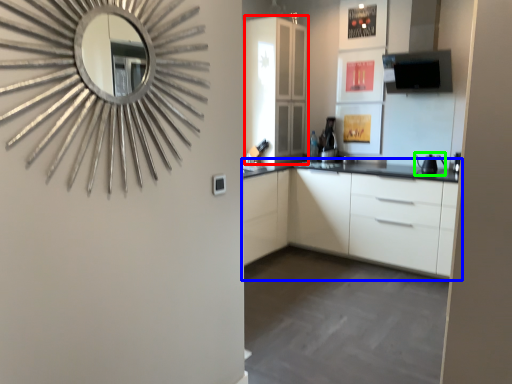
Question: Based on their relative distances, which object is farther from glass door (highlighted by a red box)? Choose from cabinetry (highlighted by a blue box) and appliance (highlighted by a green box).

Choices:
 (A) cabinetry
 (B) appliance

Answer: (B)